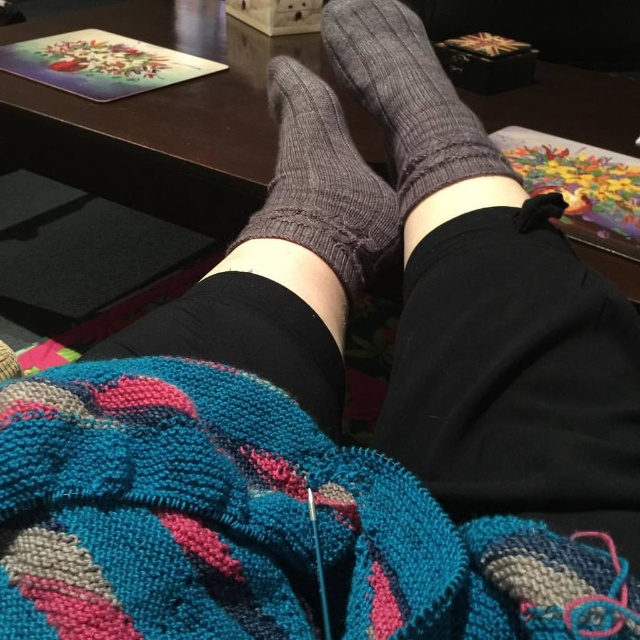
Question: Is knitted fabric leg at center above knit fabric socks at center?

Choices:
 (A) yes
 (B) no

Answer: (A)

Question: Which object is positioned closest to the knitted fabric leg at center?

Choices:
 (A) knitted woolen blanket at lower center
 (B) knitted fabric sock at center

Answer: (B)

Question: Is knitted woolen blanket at lower center positioned behind dark gray knitted sock at center?

Choices:
 (A) yes
 (B) no

Answer: (B)

Question: Based on their relative distances, which object is nearer to the knitted fabric sock at center?

Choices:
 (A) knit fabric socks at center
 (B) knitted woolen blanket at lower center
 (C) wooden table at upper center
 (D) knitted fabric leg at center

Answer: (A)

Question: Is knitted gray sock at center in front of knitted fabric sock at center?

Choices:
 (A) no
 (B) yes

Answer: (A)

Question: Which point appears farthest from the camera in this image?

Choices:
 (A) (600, 525)
 (B) (346, 132)

Answer: (B)